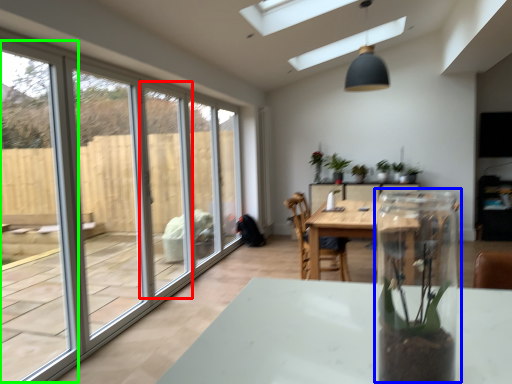
Question: Which object is the farthest from screen door (highlighted by a red box)? Choose among these: glass box (highlighted by a blue box) or window frame (highlighted by a green box).

Choices:
 (A) glass box
 (B) window frame

Answer: (B)